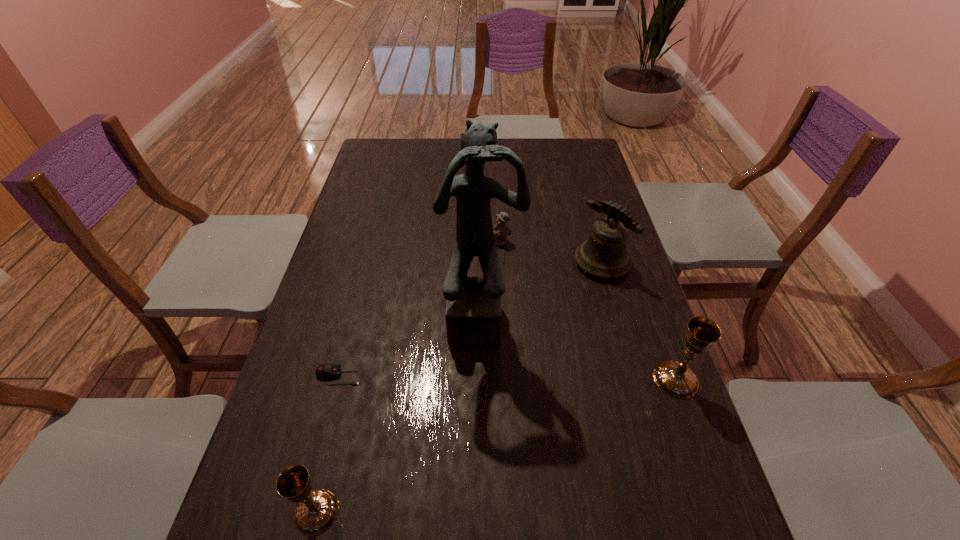
You are a GUI agent. You are given a task and a screenshot of the screen. Output one action in this format:
    pyautogui.click(x=<x>, y=<y>)
    Task: Click on the object that is at the near left corner
    Image resolution: width=960 pixels, height=540 pixels.
    Given the screenshot: What is the action you would take?
    pyautogui.click(x=316, y=511)

At what (x,y) coordinates should I click in order to perform the action: click on free space at the far edge of the desktop. Please return your answer as a coordinate pair (x, y). Image resolution: width=960 pixels, height=540 pixels. Looking at the image, I should click on (534, 138).

Locate an element on the screen. Image resolution: width=960 pixels, height=540 pixels. vacant area at the near edge of the desktop is located at coordinates (564, 507).

The height and width of the screenshot is (540, 960). Find the location of `free space at the left edge of the desktop`. free space at the left edge of the desktop is located at coordinates click(x=385, y=245).

At what (x,y) coordinates should I click in order to perform the action: click on vacant area at the right edge. Please return your answer as a coordinate pair (x, y). This screenshot has width=960, height=540. Looking at the image, I should click on (583, 231).

The image size is (960, 540). In the image, there is a desktop. In order to click on free region at the far left corner in this screenshot , I will do [372, 144].

You are a GUI agent. You are given a task and a screenshot of the screen. Output one action in this format:
    pyautogui.click(x=<x>, y=<y>)
    Task: Click on the vacant area between the farther chalice and the fifth tallest object
    
    Given the screenshot: What is the action you would take?
    pyautogui.click(x=588, y=310)

Locate an element on the screen. The image size is (960, 540). blank region between the left chalice and the fourth nearest object is located at coordinates coord(399,414).

The width and height of the screenshot is (960, 540). Find the location of `empty space between the mouse and the right chalice`. empty space between the mouse and the right chalice is located at coordinates (507, 378).

Find the location of `free area in between the fourth nearest object and the farther chalice`. free area in between the fourth nearest object and the farther chalice is located at coordinates [x=579, y=348].